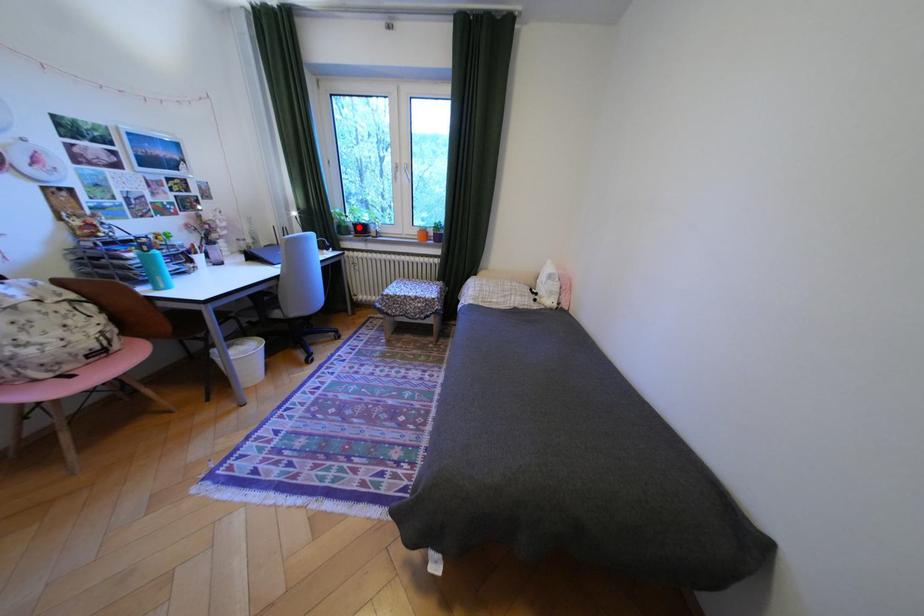
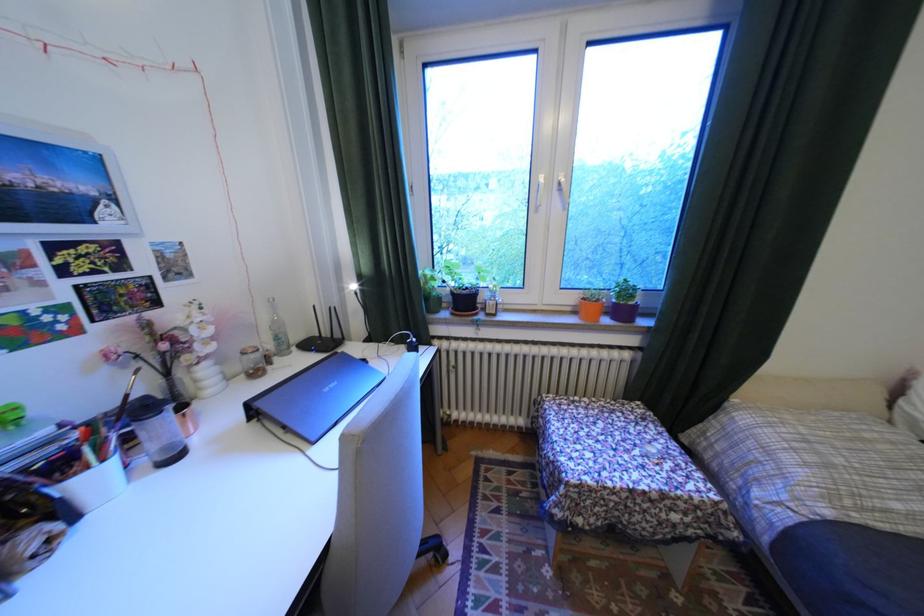
Question: A red point is marked in image1. In image2, is the corresponding 3D point closer to the camera or farther? Reply with the corresponding letter.

Choices:
 (A) The corresponding 3D point is closer.
 (B) The corresponding 3D point is farther.

Answer: (B)